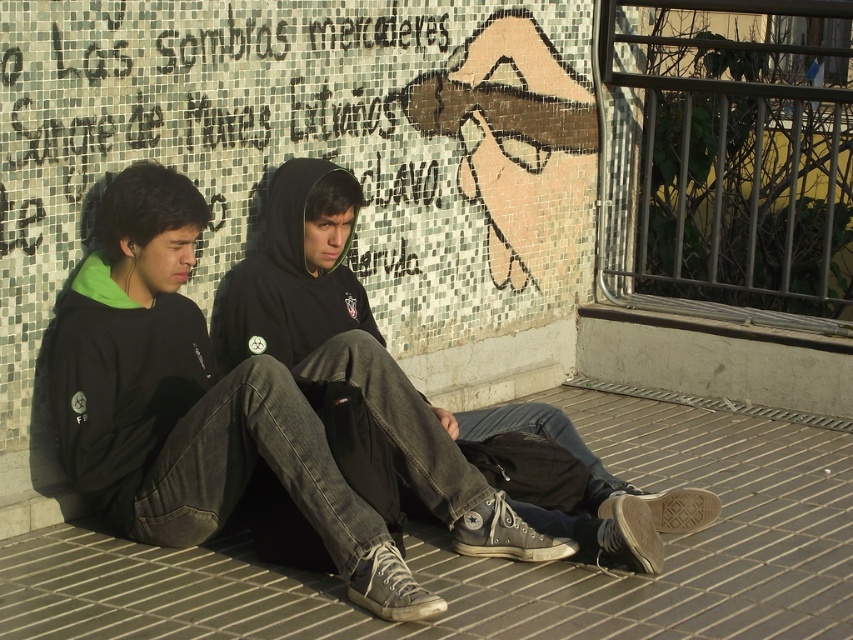
You are a photographer trying to capture both the black matte hoodie at center and the dark gray hoodie at center in a single shot. Based on their positions, which one will appear closer to the camera in the photo?

The black matte hoodie at center will appear closer to the camera because it is positioned in front of the dark gray hoodie at center.

You are a photographer trying to capture the gray brick pavement at lower center and the black matte hoodie at center in the same frame. Which object should you focus on first to ensure both are in focus?

You should focus on the gray brick pavement at lower center first because it is closer to the viewer than the black matte hoodie at center, so focusing on the closer object will help both be in focus.

You are a photographer trying to capture a photo of the gray brick pavement at lower center and the dark gray hoodie at center. Which object is located to the right of the other?

The gray brick pavement at lower center is positioned on the right side of dark gray hoodie at center, so the gray brick pavement at lower center is to the right of the dark gray hoodie at center.